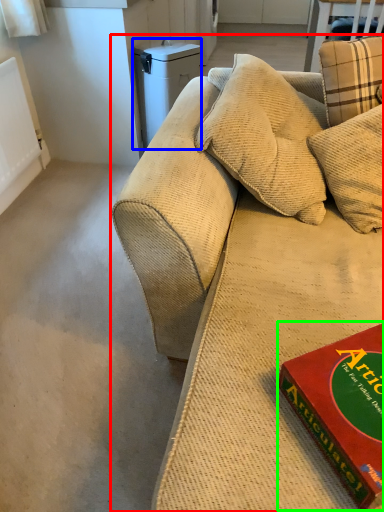
Question: Considering the real-world distances, which object is farthest from studio couch (highlighted by a red box)? appliance (highlighted by a blue box) or paperback book (highlighted by a green box)?

Choices:
 (A) appliance
 (B) paperback book

Answer: (A)